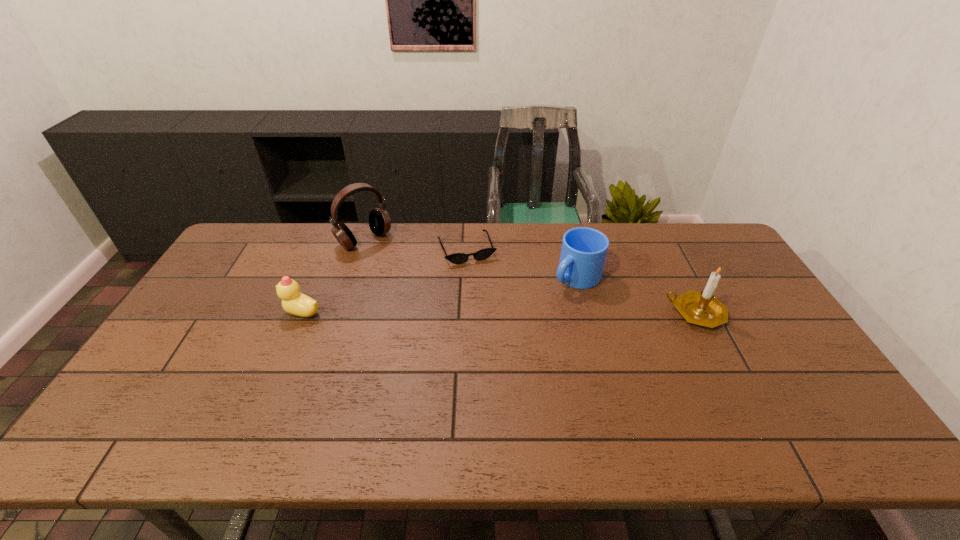
Find the location of a particular element. The width and height of the screenshot is (960, 540). free spot at the far left corner of the desktop is located at coordinates (257, 264).

Find the location of a particular element. vacant area at the near left corner of the desktop is located at coordinates (167, 408).

I want to click on free space at the far right corner of the desktop, so click(728, 245).

The height and width of the screenshot is (540, 960). Find the location of `free space at the near right corner of the desktop`. free space at the near right corner of the desktop is located at coordinates (778, 382).

Image resolution: width=960 pixels, height=540 pixels. I want to click on vacant point located between the duckling and the mug, so (x=439, y=295).

You are a GUI agent. You are given a task and a screenshot of the screen. Output one action in this format:
    pyautogui.click(x=<x>, y=<y>)
    Task: Click on the empty space that is in between the fourth object from left to right and the third object from left to right
    Image resolution: width=960 pixels, height=540 pixels.
    Given the screenshot: What is the action you would take?
    pyautogui.click(x=521, y=263)

The width and height of the screenshot is (960, 540). I want to click on vacant space in between the headset and the second object from right to left, so click(470, 259).

Where is `blank region between the headset and the duckling`? Image resolution: width=960 pixels, height=540 pixels. blank region between the headset and the duckling is located at coordinates (333, 276).

At what (x,y) coordinates should I click in order to perform the action: click on free spot between the duckling and the third object from left to right. Please return your answer as a coordinate pair (x, y). Looking at the image, I should click on (384, 281).

At what (x,y) coordinates should I click in order to perform the action: click on vacant point located between the candle holder and the second object from right to left. Please return your answer as a coordinate pair (x, y). Looking at the image, I should click on (636, 295).